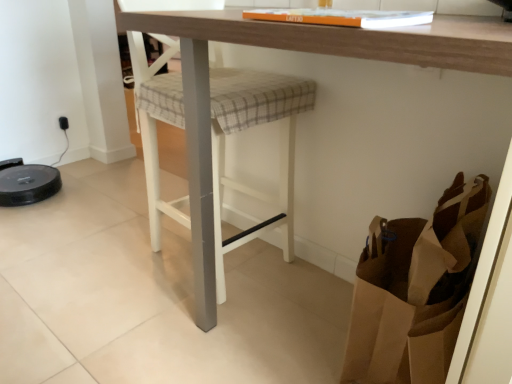
Question: Is wooden table at center wider or thinner than brown paper bag at lower right?

Choices:
 (A) wide
 (B) thin

Answer: (A)

Question: From a real-world perspective, is wooden table at center physically located above or below brown paper bag at lower right?

Choices:
 (A) below
 (B) above

Answer: (B)

Question: Which is farther from the plaid fabric step stool at center?

Choices:
 (A) brown paper bag at lower right
 (B) wooden table at center

Answer: (A)

Question: Considering the real-world distances, which object is closest to the brown paper bag at lower right?

Choices:
 (A) plaid fabric step stool at center
 (B) wooden table at center

Answer: (B)